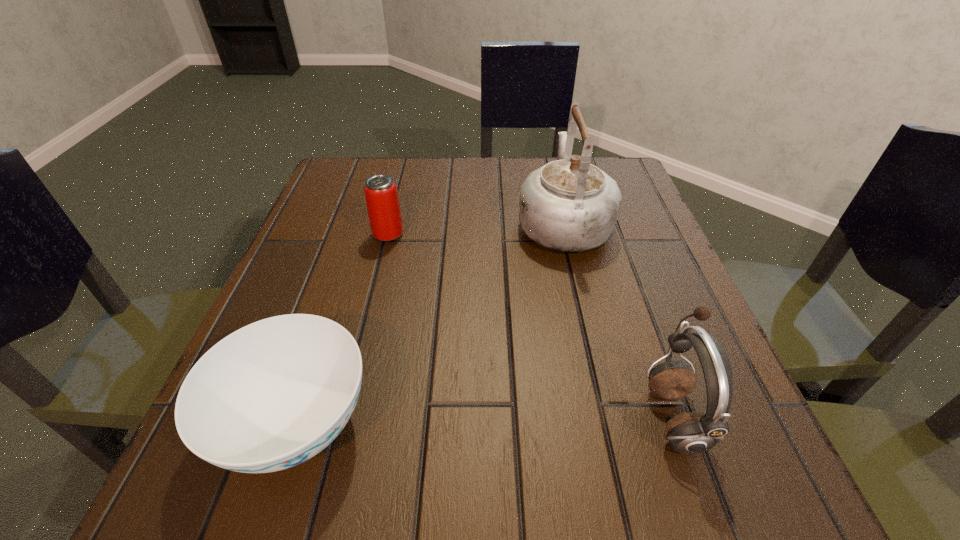
Identify the location of object situated at the far right corner. The image size is (960, 540). (569, 205).

The width and height of the screenshot is (960, 540). I want to click on object at the near right corner, so click(692, 432).

Locate an element on the screen. Image resolution: width=960 pixels, height=540 pixels. vacant space at the far edge of the desktop is located at coordinates (399, 180).

This screenshot has height=540, width=960. Identify the location of free region at the near edge. (524, 456).

Locate an element on the screen. vacant space at the left edge of the desktop is located at coordinates coord(348,222).

The height and width of the screenshot is (540, 960). I want to click on free point at the right edge, so click(x=605, y=325).

Locate an element on the screen. The width and height of the screenshot is (960, 540). vacant space at the near right corner is located at coordinates (658, 460).

Image resolution: width=960 pixels, height=540 pixels. Identify the location of vacant space that's between the kettle and the earphone. (618, 319).

This screenshot has height=540, width=960. What are the coordinates of `vacant region between the kettle and the chinaware` in the screenshot? It's located at [430, 323].

The image size is (960, 540). Identify the location of free space that is in between the second tallest object and the beer can. (531, 325).